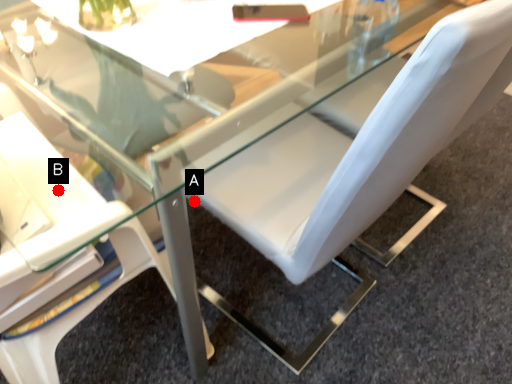
Question: Two points are circled on the image, labeled by A and B beside each circle. Which point is closer to the camera?

Choices:
 (A) A is closer
 (B) B is closer

Answer: (B)